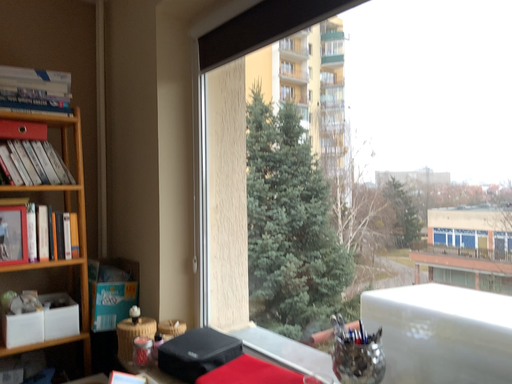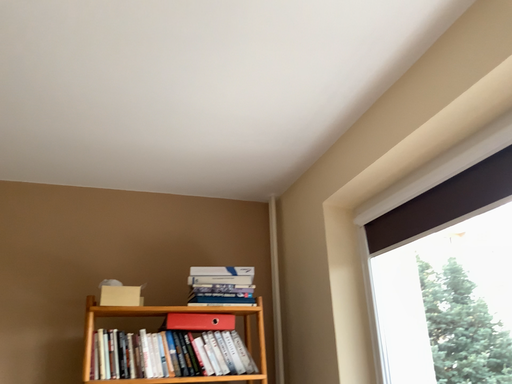
Question: Which way did the camera rotate in the video?

Choices:
 (A) rotated left
 (B) rotated right

Answer: (A)